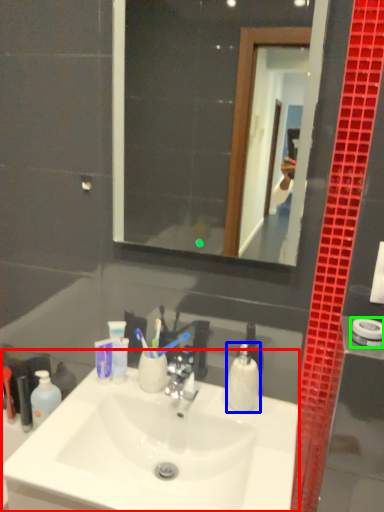
Question: Which object is positioned farthest from sink (highlighted by a red box)? Select from soap dispenser (highlighted by a blue box) and towel bar (highlighted by a green box).

Choices:
 (A) soap dispenser
 (B) towel bar

Answer: (B)